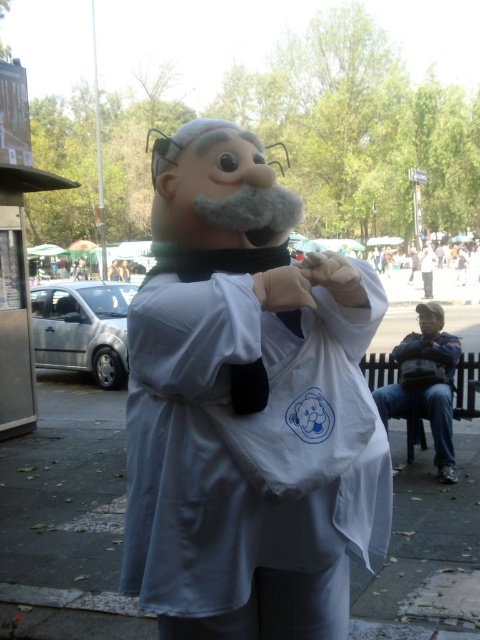
Question: Is white matte bag at center to the right of dark blue jeans at lower right from the viewer's perspective?

Choices:
 (A) no
 (B) yes

Answer: (A)

Question: Does white matte bag at center come in front of dark blue jeans at lower right?

Choices:
 (A) no
 (B) yes

Answer: (B)

Question: Among these points, which one is nearest to the camera?

Choices:
 (A) (273, 301)
 (B) (442, 355)

Answer: (A)

Question: Does white matte bag at center have a larger size compared to dark blue jeans at lower right?

Choices:
 (A) yes
 (B) no

Answer: (B)